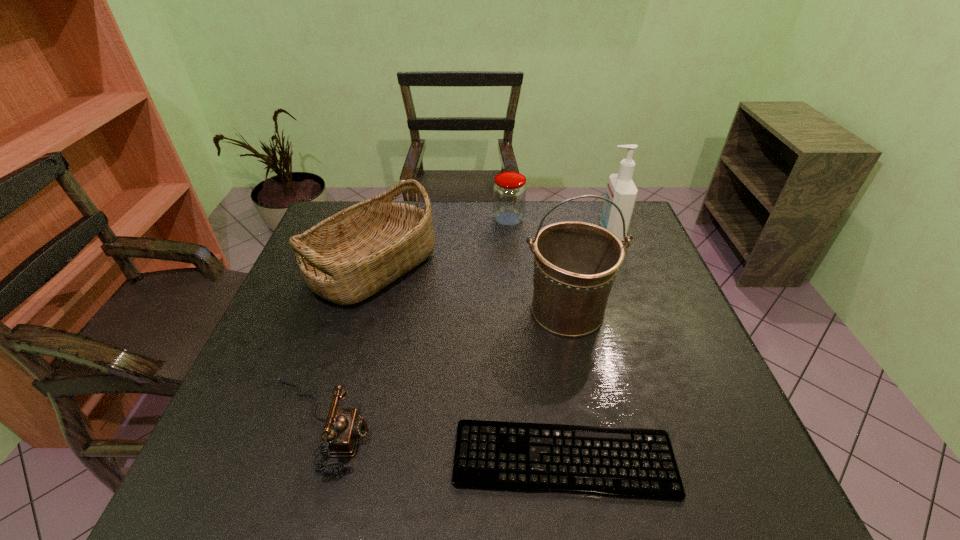
Find the location of a particular element. Image resolution: width=960 pixels, height=540 pixels. basket positioned at the left edge is located at coordinates (348, 257).

Find the location of a particular element. The height and width of the screenshot is (540, 960). telephone positioned at the left edge is located at coordinates (344, 426).

This screenshot has width=960, height=540. In order to click on cleansing agent that is positioned at the right edge in this screenshot , I will do `click(621, 190)`.

What are the coordinates of `computer keyboard located in the right edge section of the desktop` in the screenshot? It's located at (630, 463).

Locate an element on the screen. The image size is (960, 540). object that is at the far left corner is located at coordinates (348, 257).

Where is `object that is at the near left corner`? The height and width of the screenshot is (540, 960). object that is at the near left corner is located at coordinates (344, 426).

Where is `object that is at the far right corner`? object that is at the far right corner is located at coordinates (621, 190).

Image resolution: width=960 pixels, height=540 pixels. I want to click on object situated at the near right corner, so click(630, 463).

Image resolution: width=960 pixels, height=540 pixels. I want to click on vacant space at the far edge, so [469, 241].

Where is `free location at the near edge`? free location at the near edge is located at coordinates (391, 474).